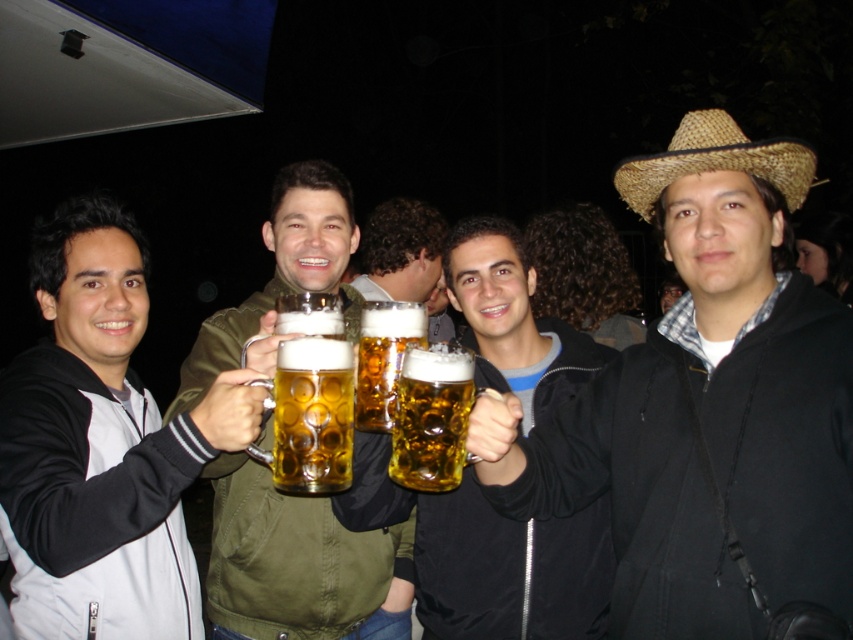
You are planning to place a decorative ribbon between the shiny brass mug at center and the straw hat at upper right. The ribbon is 36 inches long. Will the ribbon be long enough to stretch between them?

The distance between the shiny brass mug at center and the straw hat at upper right is 36.93 inches. Since the ribbon is only 36 inches long, it will be 0.93 inches short and not long enough to stretch between them.

You are a bartender at the event and need to determine which object is taller between the shiny brass mug at center and the straw hat at upper right to decide which one can fit under a low hanging shelf. Which object is taller?

The shiny brass mug at center is taller than the straw hat at upper right, so it cannot fit under the low hanging shelf.

You are a photographer at the event and want to capture a photo where the matte black jacket at center and the shiny brass mug at center are both clearly visible. Given their positions, which object is more likely to block the view of the other?

The matte black jacket at center might be wider than shiny brass mug at center, so the jacket could potentially block the view of the mug depending on their exact positions.